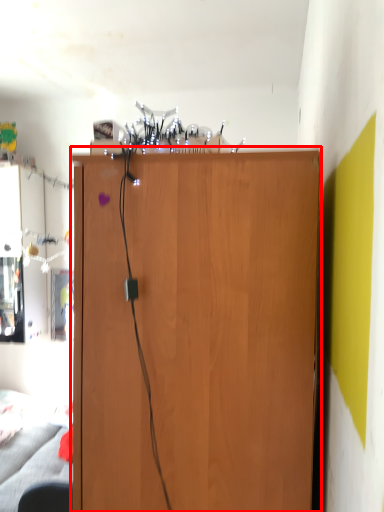
Question: From the image, what is the correct spatial relationship of cupboard (annotated by the red box) in relation to swivel chair?

Choices:
 (A) right
 (B) left

Answer: (A)